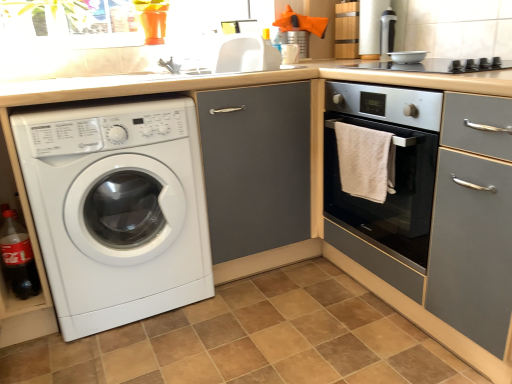
Question: Is matte gray cabinet at center a part of brown tile at lower center?

Choices:
 (A) no
 (B) yes

Answer: (A)

Question: Considering the relative sizes of brown tile at lower center and matte gray cabinet at center in the image provided, is brown tile at lower center thinner than matte gray cabinet at center?

Choices:
 (A) yes
 (B) no

Answer: (B)

Question: Considering the relative sizes of brown tile at lower center and matte gray cabinet at center in the image provided, is brown tile at lower center wider than matte gray cabinet at center?

Choices:
 (A) yes
 (B) no

Answer: (A)

Question: From the image's perspective, is brown tile at lower center above matte gray cabinet at center?

Choices:
 (A) yes
 (B) no

Answer: (B)

Question: Does brown tile at lower center have a smaller size compared to matte gray cabinet at center?

Choices:
 (A) no
 (B) yes

Answer: (B)

Question: Is white textured towel at right inside or outside of white glossy washing machine at lower left?

Choices:
 (A) inside
 (B) outside

Answer: (B)

Question: In terms of height, does white textured towel at right look taller or shorter compared to white glossy washing machine at lower left?

Choices:
 (A) short
 (B) tall

Answer: (A)

Question: Is white textured towel at right bigger or smaller than white glossy washing machine at lower left?

Choices:
 (A) big
 (B) small

Answer: (B)

Question: From the image's perspective, is white textured towel at right positioned above or below white glossy washing machine at lower left?

Choices:
 (A) below
 (B) above

Answer: (B)

Question: In the image, is matte gray cabinet at center on the left side or the right side of brown tile at lower center?

Choices:
 (A) right
 (B) left

Answer: (A)

Question: Is matte gray cabinet at center situated inside brown tile at lower center or outside?

Choices:
 (A) outside
 (B) inside

Answer: (A)

Question: Is matte gray cabinet at center in front of or behind brown tile at lower center in the image?

Choices:
 (A) behind
 (B) front

Answer: (A)

Question: From the image's perspective, is matte gray cabinet at center above or below brown tile at lower center?

Choices:
 (A) above
 (B) below

Answer: (A)

Question: Choose the correct answer: Is translucent plastic bottle at lower left inside matte gray cabinet at center or outside it?

Choices:
 (A) inside
 (B) outside

Answer: (B)

Question: Is translucent plastic bottle at lower left to the left or to the right of matte gray cabinet at center in the image?

Choices:
 (A) left
 (B) right

Answer: (A)